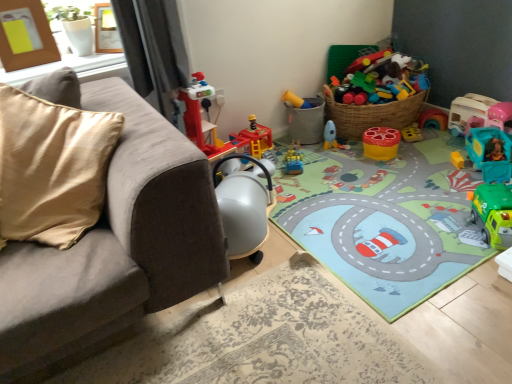
The width and height of the screenshot is (512, 384). What do you see at coordinates (475, 113) in the screenshot?
I see `teal plastic toy car at right, arranged as the 6th toy when viewed from the left` at bounding box center [475, 113].

How much space does teal plastic toy car at right, marked as the first toy in a right-to-left arrangement, occupy vertically?

The height of teal plastic toy car at right, marked as the first toy in a right-to-left arrangement, is 9.21 inches.

At what (x,y) coordinates should I click in order to perform the action: click on wooden photo frame at upper center, positioned as the first picture frame in right-to-left order. Please return your answer as a coordinate pair (x, y). Looking at the image, I should click on (106, 30).

This screenshot has height=384, width=512. Describe the element at coordinates (384, 220) in the screenshot. I see `carpeted play mat at center` at that location.

Describe the element at coordinates (493, 213) in the screenshot. I see `green plastic toy car at lower right, the 4th toy in the left-to-right sequence` at that location.

This screenshot has width=512, height=384. What are the coordinates of `yellow matte stool at center, placed as the fourth toy when sorted from right to left` in the screenshot? It's located at (381, 143).

The height and width of the screenshot is (384, 512). What do you see at coordinates (294, 160) in the screenshot? I see `shiny yellow plastic train at center, placed as the 6th toy when sorted from right to left` at bounding box center [294, 160].

In order to click on teal plastic toy car at right, placed as the second toy when sorted from right to left in this screenshot , I will do `click(490, 153)`.

In order to face teal plastic toy car at right, placed as the second toy when sorted from right to left, should I rotate leftwards or rightwards?

To face it directly, rotate right by 27.829 degrees.

What do you see at coordinates (112, 244) in the screenshot?
I see `suede gray couch at left` at bounding box center [112, 244].

This screenshot has height=384, width=512. What are the coordinates of `teal plastic toy car at right, arranged as the 6th toy when viewed from the left` in the screenshot? It's located at (475, 113).

Is wooden photo frame at upper center, positioned as the first picture frame in right-to-left order, thinner than brown wooden picture frame at upper left, the 2th picture frame positioned from the right?

No, wooden photo frame at upper center, positioned as the first picture frame in right-to-left order, is not thinner than brown wooden picture frame at upper left, the 2th picture frame positioned from the right.

Considering the positions of objects wooden photo frame at upper center, positioned as the first picture frame in right-to-left order, and brown wooden picture frame at upper left, the 1th picture frame from the left, in the image provided, who is in front, wooden photo frame at upper center, positioned as the first picture frame in right-to-left order, or brown wooden picture frame at upper left, the 1th picture frame from the left,?

Positioned in front is brown wooden picture frame at upper left, the 1th picture frame from the left.

Which of these two, wooden photo frame at upper center, positioned as the 2th picture frame in left-to-right order, or brown wooden picture frame at upper left, the 2th picture frame positioned from the right, is bigger?

brown wooden picture frame at upper left, the 2th picture frame positioned from the right.

Locate an element on the screen. picture frame lying on the right of brown wooden picture frame at upper left, the 1th picture frame from the left is located at coordinates (106, 30).

Is shiny yellow plastic train at center, placed as the 6th toy when sorted from right to left, oriented away from teal plastic toy car at right, arranged as the 6th toy when viewed from the left?

No, shiny yellow plastic train at center, placed as the 6th toy when sorted from right to left, is not facing the opposite direction of teal plastic toy car at right, arranged as the 6th toy when viewed from the left.

Is shiny yellow plastic train at center, which appears as the first toy when viewed from the left, wider than teal plastic toy car at right, marked as the first toy in a right-to-left arrangement?

Correct, the width of shiny yellow plastic train at center, which appears as the first toy when viewed from the left, exceeds that of teal plastic toy car at right, marked as the first toy in a right-to-left arrangement.

From a real-world perspective, which toy is the 5th one above the shiny yellow plastic train at center, which appears as the first toy when viewed from the left? Please provide its 2D coordinates.

[(475, 113)]

Measure the distance from shiny yellow plastic train at center, which appears as the first toy when viewed from the left, to teal plastic toy car at right, marked as the first toy in a right-to-left arrangement.

shiny yellow plastic train at center, which appears as the first toy when viewed from the left, is 35.09 inches from teal plastic toy car at right, marked as the first toy in a right-to-left arrangement.

Does point (298, 105) lie behind point (1, 6)?

Yes, it is.

Is matte plastic bucket at center, the 5th toy when ordered from right to left, in front of brown wooden picture frame at upper left, the 2th picture frame positioned from the right?

No, the depth of matte plastic bucket at center, the 5th toy when ordered from right to left, is greater than that of brown wooden picture frame at upper left, the 2th picture frame positioned from the right.

Is matte plastic bucket at center, marked as the 2th toy in a left-to-right arrangement, in contact with brown wooden picture frame at upper left, the 2th picture frame positioned from the right?

No, matte plastic bucket at center, marked as the 2th toy in a left-to-right arrangement, is not touching brown wooden picture frame at upper left, the 2th picture frame positioned from the right.

Is matte plastic bucket at center, marked as the 2th toy in a left-to-right arrangement, facing away from brown wooden picture frame at upper left, the 2th picture frame positioned from the right?

matte plastic bucket at center, marked as the 2th toy in a left-to-right arrangement, does not have its back to brown wooden picture frame at upper left, the 2th picture frame positioned from the right.

How far apart are wooden photo frame at upper center, positioned as the 2th picture frame in left-to-right order, and yellow matte stool at center, placed as the fourth toy when sorted from right to left?

wooden photo frame at upper center, positioned as the 2th picture frame in left-to-right order, is 1.34 meters away from yellow matte stool at center, placed as the fourth toy when sorted from right to left.

From the image's perspective, which is below, wooden photo frame at upper center, positioned as the first picture frame in right-to-left order, or yellow matte stool at center, placed as the fourth toy when sorted from right to left?

yellow matte stool at center, placed as the fourth toy when sorted from right to left, is shown below in the image.

I want to click on picture frame that is the 1st one when counting forward from the yellow matte stool at center, placed as the fourth toy when sorted from right to left, so click(x=106, y=30).

Relative to yellow matte stool at center, arranged as the 3th toy when viewed from the left, is wooden photo frame at upper center, positioned as the 2th picture frame in left-to-right order, in front or behind?

Visually, wooden photo frame at upper center, positioned as the 2th picture frame in left-to-right order, is located in front of yellow matte stool at center, arranged as the 3th toy when viewed from the left.

Considering the relative positions of green plastic toy car at lower right, placed as the 3th toy when sorted from right to left, and teal plastic toy car at right, placed as the second toy when sorted from right to left, in the image provided, is green plastic toy car at lower right, placed as the 3th toy when sorted from right to left, to the right of teal plastic toy car at right, placed as the second toy when sorted from right to left, from the viewer's perspective?

No.

Considering the relative sizes of green plastic toy car at lower right, placed as the 3th toy when sorted from right to left, and teal plastic toy car at right, placed as the fifth toy when sorted from left to right, in the image provided, is green plastic toy car at lower right, placed as the 3th toy when sorted from right to left, bigger than teal plastic toy car at right, placed as the fifth toy when sorted from left to right,?

Actually, green plastic toy car at lower right, placed as the 3th toy when sorted from right to left, might be smaller than teal plastic toy car at right, placed as the fifth toy when sorted from left to right.

Is green plastic toy car at lower right, placed as the 3th toy when sorted from right to left, wider than teal plastic toy car at right, placed as the fifth toy when sorted from left to right?

No, green plastic toy car at lower right, placed as the 3th toy when sorted from right to left, is not wider than teal plastic toy car at right, placed as the fifth toy when sorted from left to right.

Is green plastic toy car at lower right, placed as the 3th toy when sorted from right to left, not inside teal plastic toy car at right, placed as the fifth toy when sorted from left to right?

Yes, green plastic toy car at lower right, placed as the 3th toy when sorted from right to left, is not within teal plastic toy car at right, placed as the fifth toy when sorted from left to right.

Would you say teal plastic toy car at right, marked as the first toy in a right-to-left arrangement, is a long distance from wooden photo frame at upper center, positioned as the 2th picture frame in left-to-right order?

Yes.

Is teal plastic toy car at right, arranged as the 6th toy when viewed from the left, positioned before wooden photo frame at upper center, positioned as the 2th picture frame in left-to-right order?

No, teal plastic toy car at right, arranged as the 6th toy when viewed from the left, is behind wooden photo frame at upper center, positioned as the 2th picture frame in left-to-right order.

Looking at this image, is teal plastic toy car at right, arranged as the 6th toy when viewed from the left, turned away from wooden photo frame at upper center, positioned as the 2th picture frame in left-to-right order?

No, teal plastic toy car at right, arranged as the 6th toy when viewed from the left,'s orientation is not away from wooden photo frame at upper center, positioned as the 2th picture frame in left-to-right order.

Is suede gray couch at left smaller than teal plastic toy car at right, placed as the fifth toy when sorted from left to right?

Incorrect, suede gray couch at left is not smaller in size than teal plastic toy car at right, placed as the fifth toy when sorted from left to right.

How much distance is there between suede gray couch at left and teal plastic toy car at right, placed as the fifth toy when sorted from left to right?

suede gray couch at left is 4.61 feet away from teal plastic toy car at right, placed as the fifth toy when sorted from left to right.

Which point is more distant from viewer, (59,259) or (486,139)?

Point (486,139)

Locate an element on the screen. Image resolution: width=512 pixels, height=384 pixels. picture frame that appears on the right of brown wooden picture frame at upper left, the 1th picture frame from the left is located at coordinates (106, 30).

From a real-world perspective, which toy is the 5th one above the shiny yellow plastic train at center, placed as the 6th toy when sorted from right to left? Please provide its 2D coordinates.

[(475, 113)]

When comparing their distances from suede gray couch at left, does yellow matte stool at center, arranged as the 3th toy when viewed from the left, or brown wooden picture frame at upper left, the 1th picture frame from the left, seem closer?

brown wooden picture frame at upper left, the 1th picture frame from the left, lies closer to suede gray couch at left than the other object.

Considering their positions, is shiny yellow plastic train at center, which appears as the first toy when viewed from the left, positioned further to brown wooden picture frame at upper left, the 2th picture frame positioned from the right, than yellow matte stool at center, placed as the fourth toy when sorted from right to left?

The object further to brown wooden picture frame at upper left, the 2th picture frame positioned from the right, is yellow matte stool at center, placed as the fourth toy when sorted from right to left.

Considering their positions, is brown wooden picture frame at upper left, the 1th picture frame from the left, positioned closer to suede gray couch at left than matte plastic bucket at center, the 5th toy when ordered from right to left?

brown wooden picture frame at upper left, the 1th picture frame from the left, lies closer to suede gray couch at left than the other object.

Looking at this image, from the image, which object appears to be nearer to yellow matte stool at center, placed as the fourth toy when sorted from right to left, carpeted play mat at center or brown wooden picture frame at upper left, the 2th picture frame positioned from the right?

The object closer to yellow matte stool at center, placed as the fourth toy when sorted from right to left, is carpeted play mat at center.

From the image, which object appears to be nearer to suede gray couch at left, brown wooden picture frame at upper left, the 2th picture frame positioned from the right, or green plastic toy car at lower right, placed as the 3th toy when sorted from right to left?

brown wooden picture frame at upper left, the 2th picture frame positioned from the right, lies closer to suede gray couch at left than the other object.

Which object lies further to the anchor point shiny yellow plastic train at center, which appears as the first toy when viewed from the left, green plastic toy car at lower right, the 4th toy in the left-to-right sequence, or matte plastic bucket at center, marked as the 2th toy in a left-to-right arrangement?

green plastic toy car at lower right, the 4th toy in the left-to-right sequence, is further to shiny yellow plastic train at center, which appears as the first toy when viewed from the left.

Estimate the real-world distances between objects in this image. Which object is further from green plastic toy car at lower right, placed as the 3th toy when sorted from right to left, wooden photo frame at upper center, positioned as the 2th picture frame in left-to-right order, or teal plastic toy car at right, placed as the second toy when sorted from right to left?

Among the two, wooden photo frame at upper center, positioned as the 2th picture frame in left-to-right order, is located further to green plastic toy car at lower right, placed as the 3th toy when sorted from right to left.

Estimate the real-world distances between objects in this image. Which object is further from yellow matte stool at center, placed as the fourth toy when sorted from right to left, brown wooden picture frame at upper left, the 1th picture frame from the left, or teal plastic toy car at right, placed as the second toy when sorted from right to left?

The object further to yellow matte stool at center, placed as the fourth toy when sorted from right to left, is brown wooden picture frame at upper left, the 1th picture frame from the left.

The height and width of the screenshot is (384, 512). Find the location of `mat located between brown wooden picture frame at upper left, the 2th picture frame positioned from the right, and teal plastic toy car at right, arranged as the 6th toy when viewed from the left, in the left-right direction`. mat located between brown wooden picture frame at upper left, the 2th picture frame positioned from the right, and teal plastic toy car at right, arranged as the 6th toy when viewed from the left, in the left-right direction is located at coordinates (384, 220).

This screenshot has width=512, height=384. I want to click on mat between brown wooden picture frame at upper left, the 2th picture frame positioned from the right, and yellow matte stool at center, arranged as the 3th toy when viewed from the left, in the horizontal direction, so click(384, 220).

The image size is (512, 384). In order to click on mat between wooden photo frame at upper center, positioned as the 2th picture frame in left-to-right order, and green plastic toy car at lower right, the 4th toy in the left-to-right sequence, from left to right in this screenshot , I will do `click(384, 220)`.

I want to click on studio couch situated between brown wooden picture frame at upper left, the 2th picture frame positioned from the right, and yellow matte stool at center, arranged as the 3th toy when viewed from the left, from left to right, so click(112, 244).